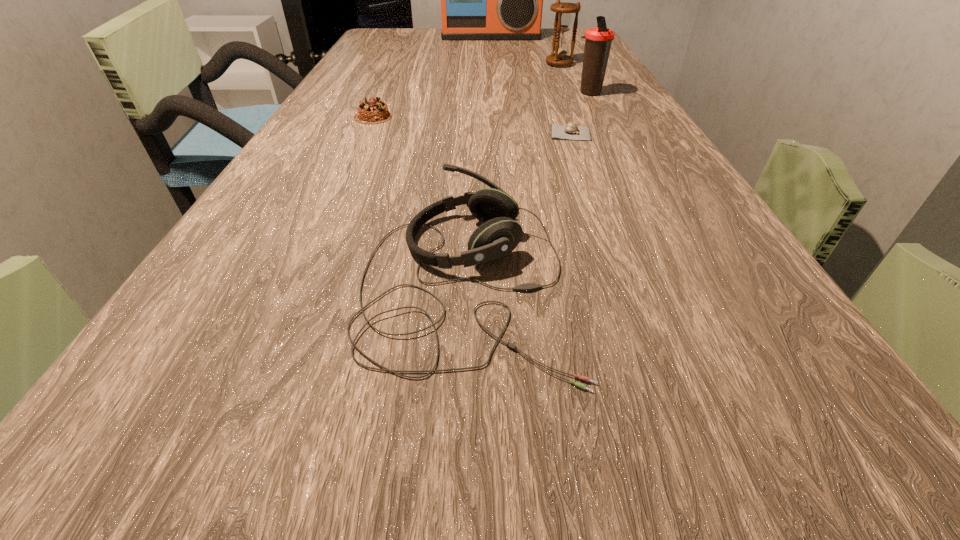
The height and width of the screenshot is (540, 960). I want to click on the farthest object, so click(x=480, y=0).

You are a GUI agent. You are given a task and a screenshot of the screen. Output one action in this format:
    pyautogui.click(x=<x>, y=<y>)
    Task: Click on the tallest object
    This screenshot has width=960, height=540.
    Given the screenshot: What is the action you would take?
    pyautogui.click(x=480, y=0)

Locate an element on the screen. thermos bottle is located at coordinates (598, 41).

Locate an element on the screen. The height and width of the screenshot is (540, 960). the fifth nearest object is located at coordinates (563, 18).

This screenshot has width=960, height=540. What are the coordinates of `the nearest object` in the screenshot? It's located at (499, 235).

Where is `the third shortest object`? Image resolution: width=960 pixels, height=540 pixels. the third shortest object is located at coordinates click(x=499, y=235).

This screenshot has height=540, width=960. In order to click on the fourth farthest object in this screenshot , I will do `click(375, 111)`.

Identify the location of the second shortest object. This screenshot has height=540, width=960. (375, 111).

Identify the location of garlic. (571, 131).

In order to click on the shortest object in this screenshot , I will do `click(571, 131)`.